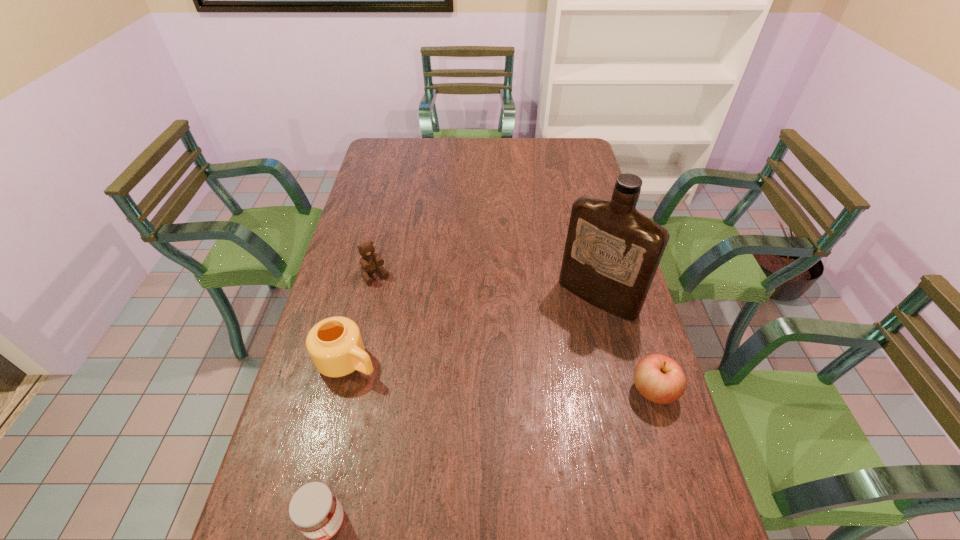
In the image, there is a desktop. Where is `vacant space at the left edge`? The height and width of the screenshot is (540, 960). vacant space at the left edge is located at coordinates (324, 482).

Locate an element on the screen. Image resolution: width=960 pixels, height=540 pixels. free region at the right edge of the desktop is located at coordinates (588, 169).

You are a GUI agent. You are given a task and a screenshot of the screen. Output one action in this format:
    pyautogui.click(x=<x>, y=<y>)
    Task: Click on the vacant space at the far right corner of the desktop
    
    Given the screenshot: What is the action you would take?
    pyautogui.click(x=555, y=143)

This screenshot has height=540, width=960. I want to click on free space that is in between the tallest object and the apple, so click(625, 343).

Identify the location of empty space between the teddy bear and the mug. (362, 318).

At what (x,y) coordinates should I click in order to perform the action: click on free space between the apple and the teddy bear. Please return your answer as a coordinate pair (x, y). The image size is (960, 540). Looking at the image, I should click on (515, 333).

Locate an element on the screen. This screenshot has height=540, width=960. free point between the teddy bear and the apple is located at coordinates (515, 333).

Where is `free space between the apple and the mug`? free space between the apple and the mug is located at coordinates (500, 375).

Find the location of a particular element. the fourth closest object to the mug is located at coordinates (660, 379).

You are a GUI agent. You are given a task and a screenshot of the screen. Output one action in this format:
    pyautogui.click(x=<x>, y=<y>)
    Task: Click on the third closest object to the apple
    This screenshot has width=960, height=540.
    Given the screenshot: What is the action you would take?
    pyautogui.click(x=314, y=509)